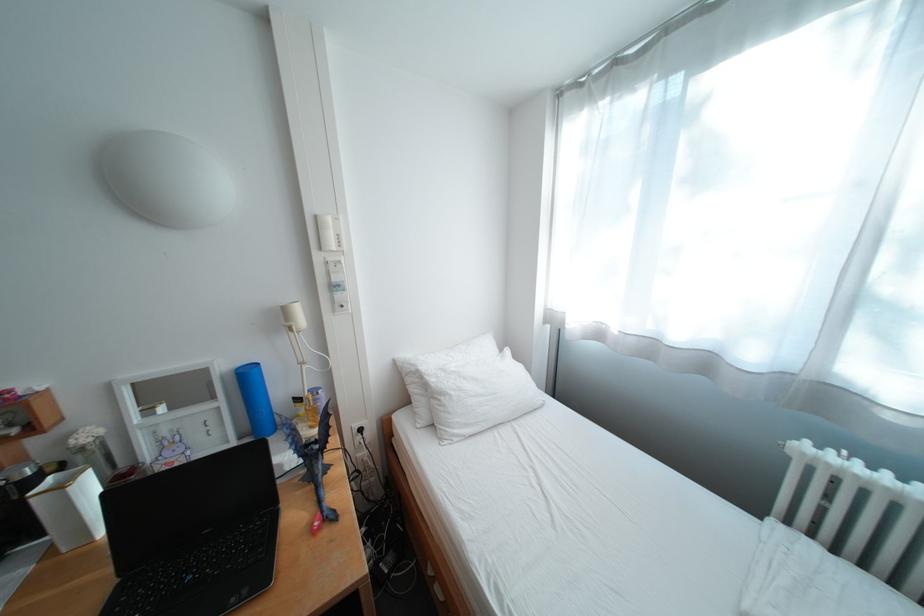
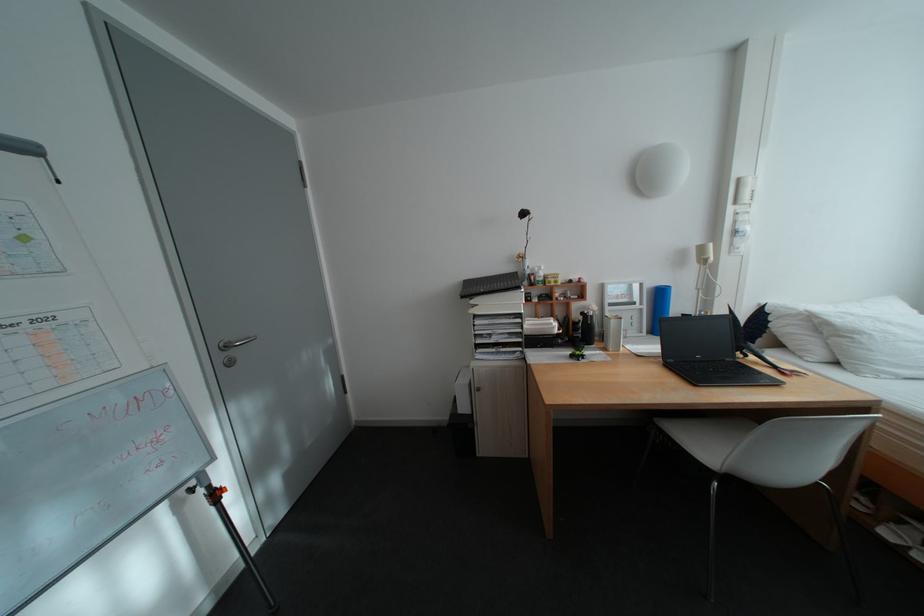
Where in the second image is the point corresponding to point 234,403 from the first image?

(657, 307)